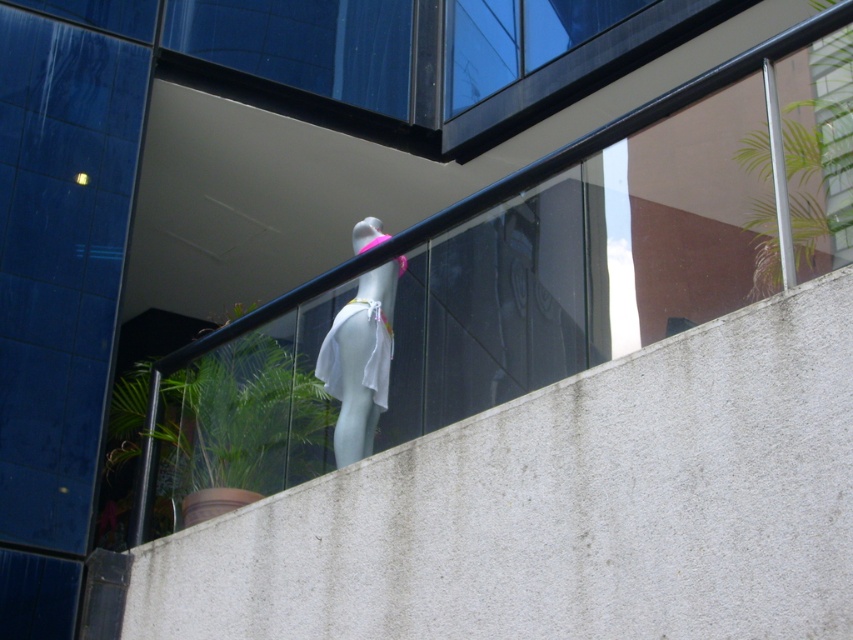
You are standing in front of the glass facade and want to place a small potted plant on the white concrete ledge at center. Given that the point coordinates are normalized between 0 and 1, can you confirm if the point at coordinates (566, 508) is the correct location for the ledge?

Yes, the point at coordinates (566, 508) corresponds to the white concrete ledge at center, so placing the potted plant there would be correct.

Consider the image. You are a delivery person trying to place a small package on a surface in the scene. The package is 1 foot in length. Which object between the white concrete ledge at center and the white matte mannequin at center would be more suitable for placing the package?

The white concrete ledge at center has a larger size compared to the white matte mannequin at center, so it would be more suitable for placing the package.